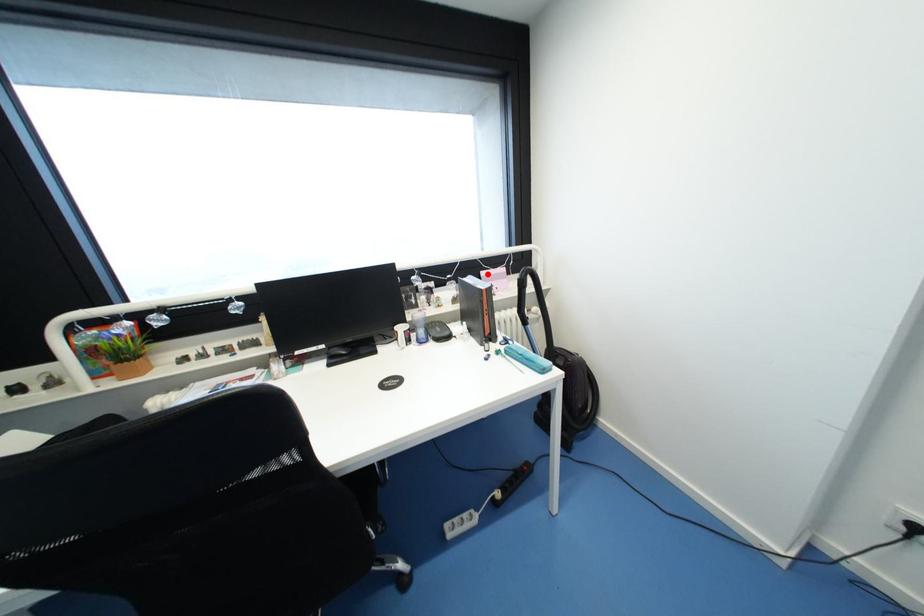
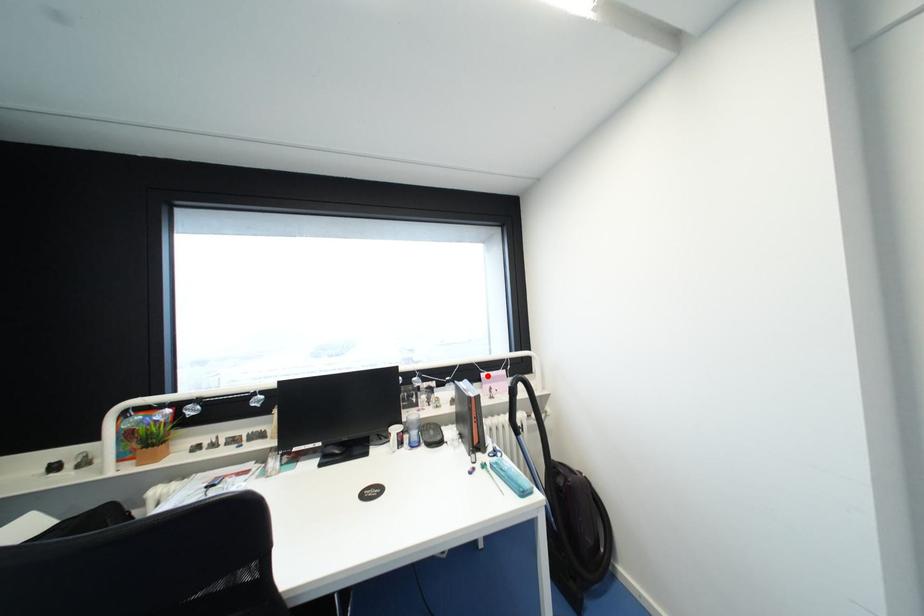
I am providing you with two images of the same scene from different viewpoints. A red point is marked on the first image and another point is marked on the second image. Is the red point in image1 aligned with the point shown in image2?

Yes